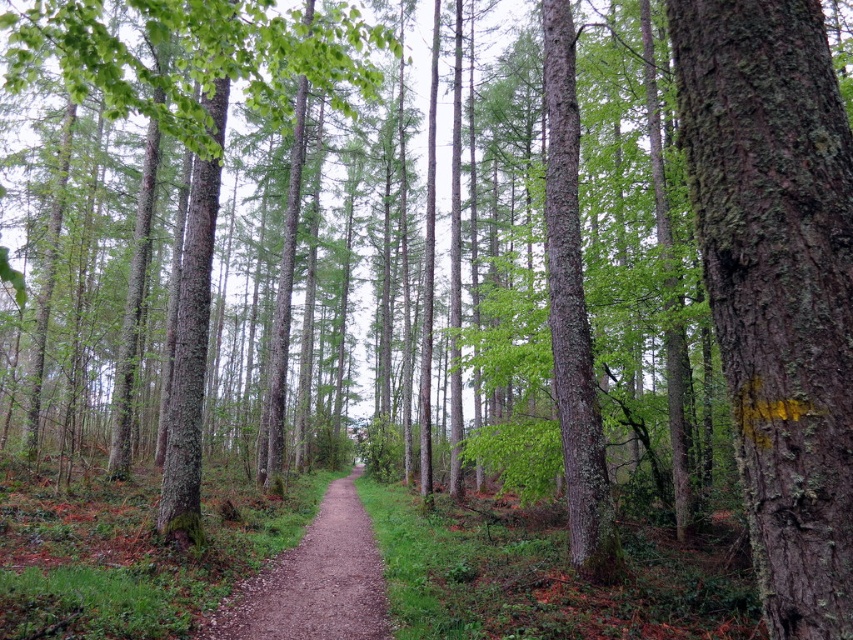
Question: Which object is positioned closest to the green mossy bark tree at right?

Choices:
 (A) smooth bark tree at center
 (B) brown gravel path at center

Answer: (B)

Question: Can you confirm if green mossy bark tree at right is positioned above brown gravel path at center?

Choices:
 (A) no
 (B) yes

Answer: (B)

Question: Is green mossy bark tree at right in front of smooth bark tree at center?

Choices:
 (A) yes
 (B) no

Answer: (A)

Question: Can you confirm if smooth bark tree at center is positioned above brown gravel path at center?

Choices:
 (A) yes
 (B) no

Answer: (A)

Question: Estimate the real-world distances between objects in this image. Which object is farther from the brown gravel path at center?

Choices:
 (A) green mossy bark tree at right
 (B) smooth bark tree at center

Answer: (B)

Question: Which of the following is the farthest from the observer?

Choices:
 (A) green mossy bark tree at right
 (B) brown gravel path at center
 (C) smooth bark tree at center

Answer: (B)